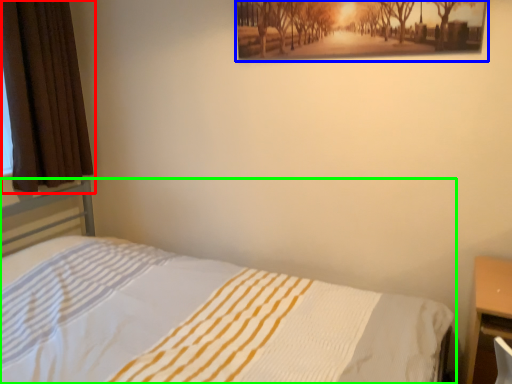
Question: Which object is positioned farthest from curtain (highlighted by a red box)? Select from picture frame (highlighted by a blue box) and bed (highlighted by a green box).

Choices:
 (A) picture frame
 (B) bed

Answer: (A)